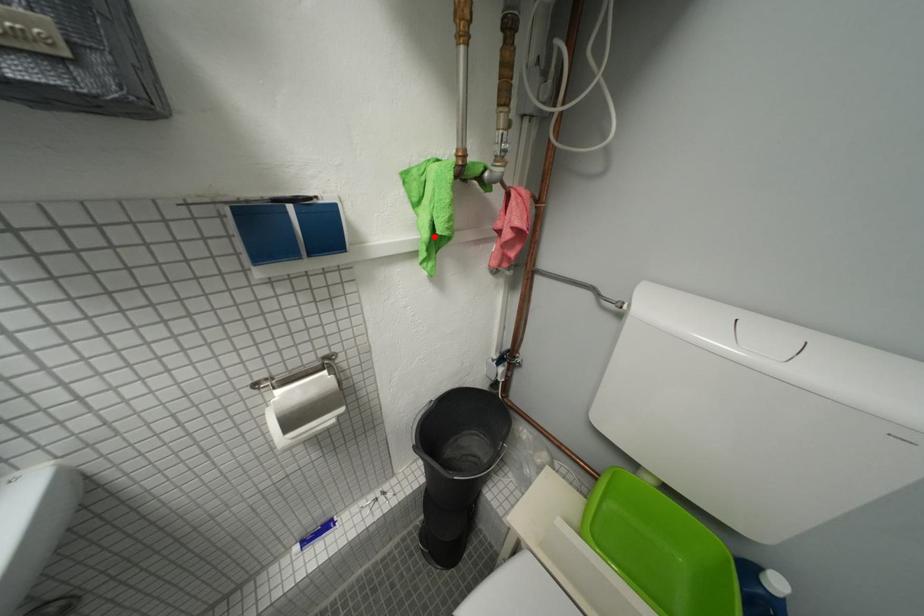
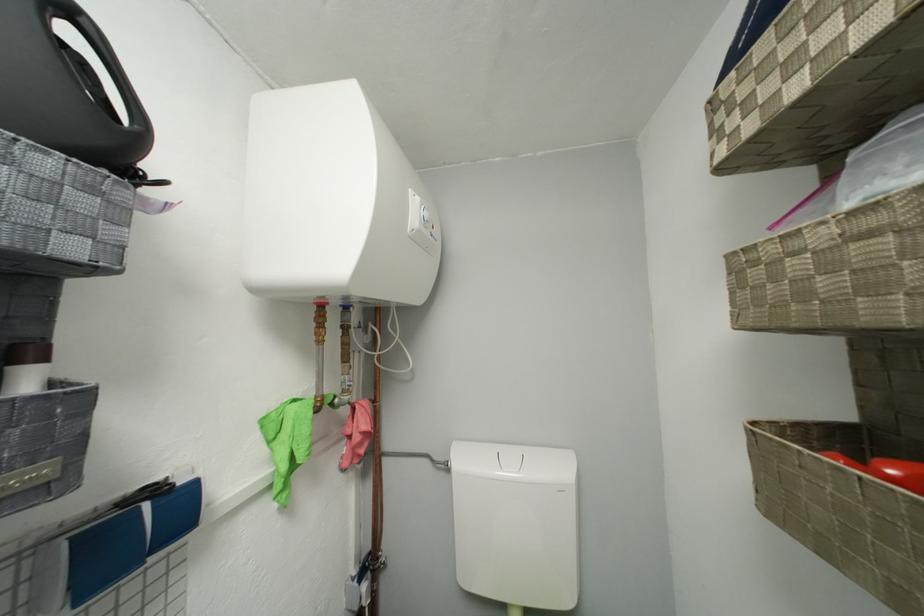
The point at the highlighted location is marked in the first image. Where is the corresponding point in the second image?

(293, 469)